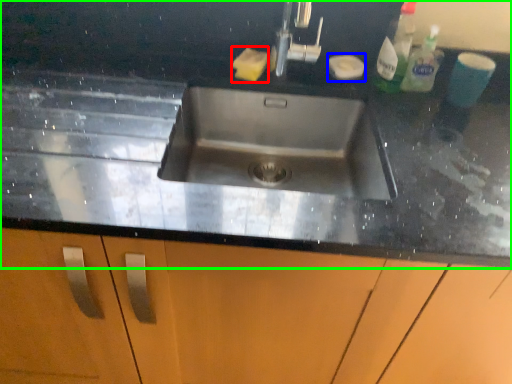
Question: Based on their relative distances, which object is nearer to soap (highlighted by a red box)? Choose from soap (highlighted by a blue box) and countertop (highlighted by a green box).

Choices:
 (A) soap
 (B) countertop

Answer: (A)